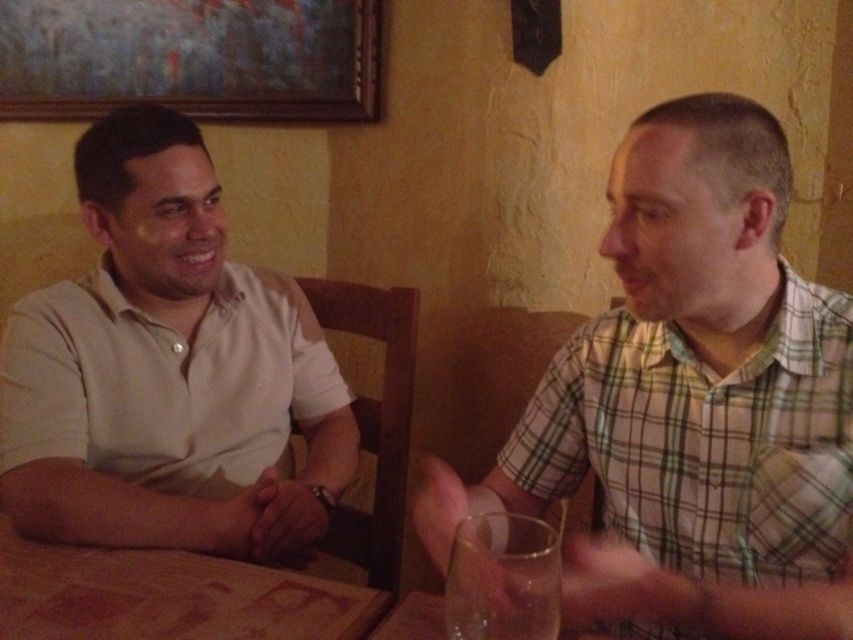
You are a customer in this restaurant and want to place your phone on the table. The transparent glass at lower right is in the way. Can you slide your phone to the left to place it near the painted wood picture frame at upper left without moving the glass?

Yes, since the painted wood picture frame at upper left is to the left of the transparent glass at lower right, you can slide your phone to the left around the glass to place it near the frame.

You are a photographer trying to capture a candid shot of the matte white shirt at left and the painted wood picture frame at upper left. Since you can only focus on one subject at a time, which object should you focus on to ensure the other is still in the background?

The matte white shirt at left should be focused on because it is positioned to the right of the painted wood picture frame at upper left, placing the frame in the background.

You are a photographer trying to capture a closeup of the matte white shirt at left and the painted wood picture frame at upper left. Which object should you zoom in on to ensure both are in focus without moving the camera?

The matte white shirt at left has a smaller size compared to the painted wood picture frame at upper left, so you should zoom in on the smaller matte white shirt at left to ensure both are in focus without moving the camera.